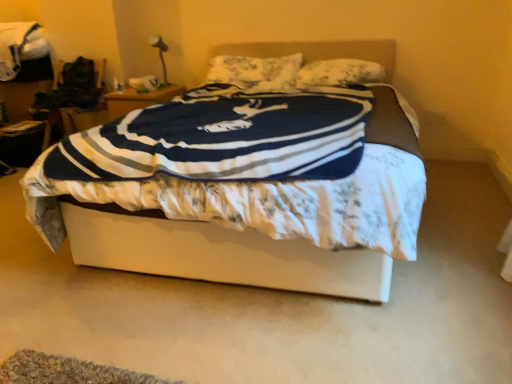
Question: Considering the positions of metallic silver table lamp at upper left and floral fabric pillow at center, marked as the 1th pillow in a left-to-right arrangement, in the image, is metallic silver table lamp at upper left taller or shorter than floral fabric pillow at center, marked as the 1th pillow in a left-to-right arrangement,?

Choices:
 (A) short
 (B) tall

Answer: (B)

Question: From the image's perspective, relative to floral fabric pillow at center, the 2th pillow in the right-to-left sequence, is metallic silver table lamp at upper left above or below?

Choices:
 (A) below
 (B) above

Answer: (B)

Question: Considering the real-world distances, which object is farthest from the matte black blanket at upper left?

Choices:
 (A) floral fabric pillow at center, the 2th pillow in the right-to-left sequence
 (B) fluffy white pillow at upper center, marked as the first pillow in a right-to-left arrangement
 (C) metallic silver table lamp at upper left
 (D) white fabric bed at center

Answer: (D)

Question: Which object is the farthest from the fluffy white pillow at upper center, marked as the first pillow in a right-to-left arrangement?

Choices:
 (A) floral fabric pillow at center, the 2th pillow in the right-to-left sequence
 (B) matte black blanket at upper left
 (C) white fabric bed at center
 (D) metallic silver table lamp at upper left

Answer: (B)